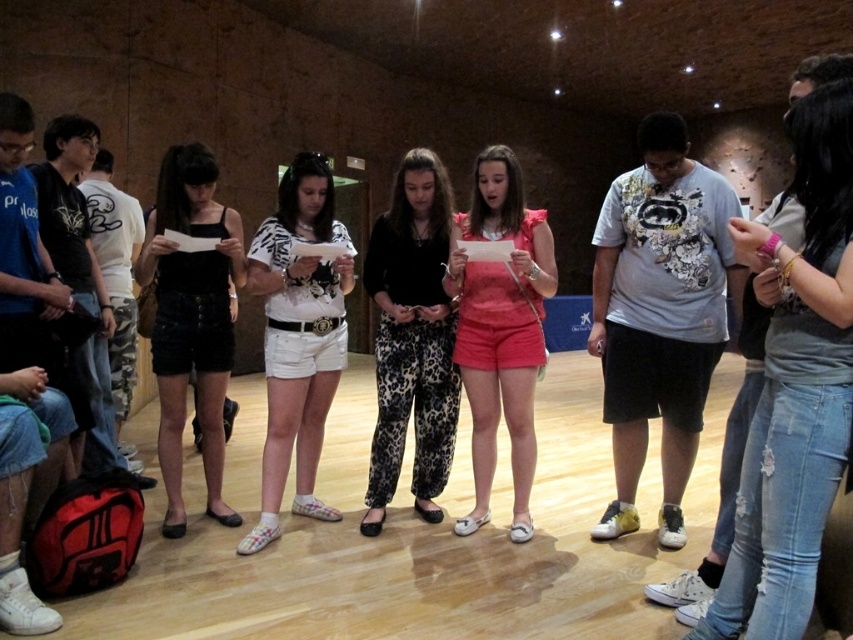
In the scene described, where exactly is the black leopard print pants at center located in terms of coordinates?

The black leopard print pants at center is located at coordinates point (412,339).

You are standing in the room and want to see the person wearing the black denim shorts at center. However, the black leopard print pants at center is blocking your view. Can you move around to see them?

The black denim shorts at center is behind the black leopard print pants at center, so you can move around to the side of the black leopard print pants at center to get a clear view of the black denim shorts at center.